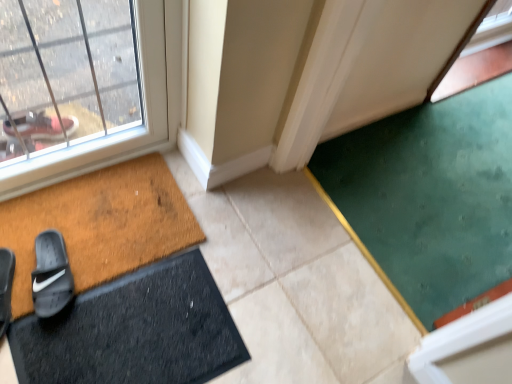
I want to click on vacant area to the right of brown textured doormat at lower left, which ranks as the second bath mat in bottom-to-top order, so click(238, 267).